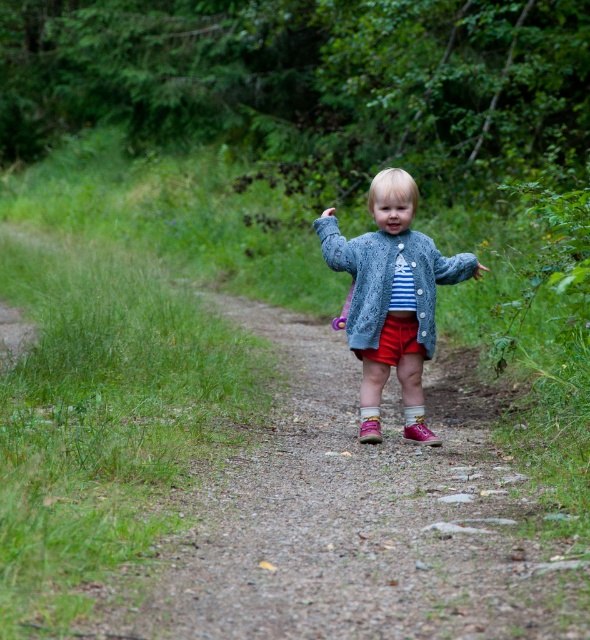
Can you confirm if knitted blue sweater at center is positioned below denim jacket at center?

Yes, knitted blue sweater at center is below denim jacket at center.

Can you confirm if knitted blue sweater at center is bigger than denim jacket at center?

Correct, knitted blue sweater at center is larger in size than denim jacket at center.

Who is more forward, (381, 353) or (348, 330)?

Positioned in front is point (381, 353).

Identify the location of knitted blue sweater at center. (391, 298).